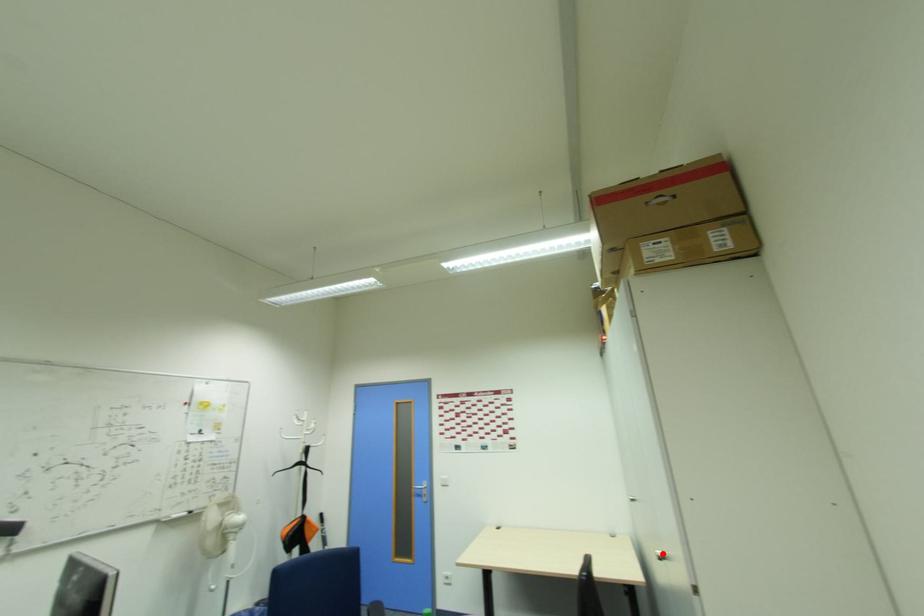
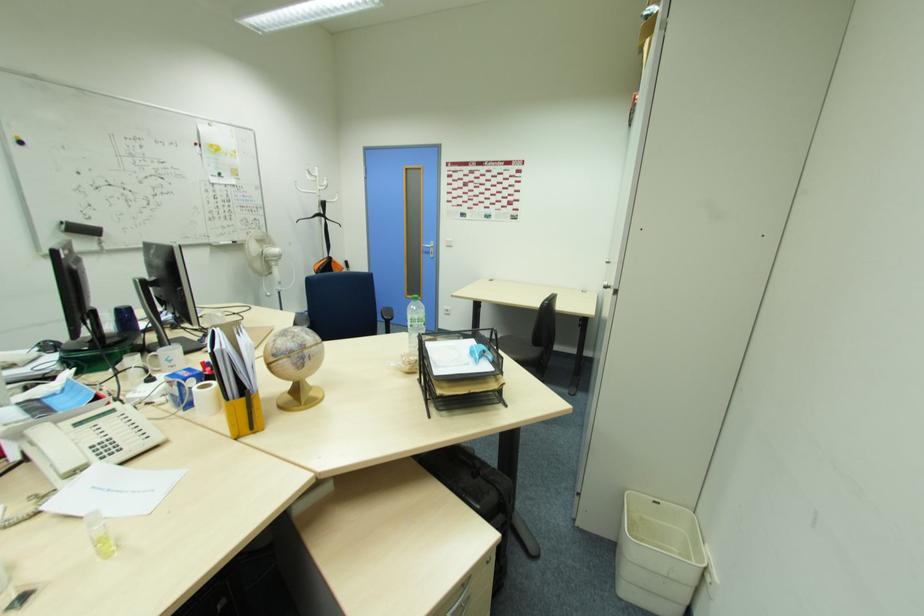
The point at the highlighted location is marked in the first image. Where is the corresponding point in the second image?

(608, 280)